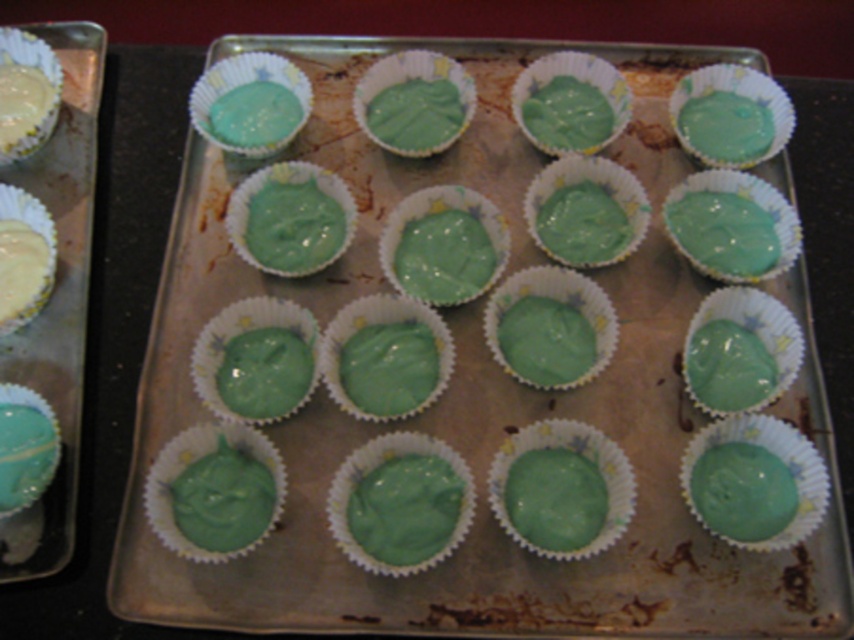
Question: Observing the image, what is the correct spatial positioning of matte green cupcake at center in reference to matte yellow muffin at upper left?

Choices:
 (A) below
 (B) above

Answer: (A)

Question: Among these points, which one is nearest to the camera?

Choices:
 (A) (513, 392)
 (B) (0, 60)

Answer: (A)

Question: Can you confirm if matte green cupcake at center is thinner than matte yellow muffin at upper left?

Choices:
 (A) yes
 (B) no

Answer: (B)

Question: Which of the following is the closest to the observer?

Choices:
 (A) (185, 353)
 (B) (15, 86)

Answer: (A)

Question: Which point is farther to the camera?

Choices:
 (A) matte yellow muffin at upper left
 (B) matte green cupcake at center

Answer: (A)

Question: Is matte green cupcake at center further to camera compared to matte yellow muffin at upper left?

Choices:
 (A) no
 (B) yes

Answer: (A)